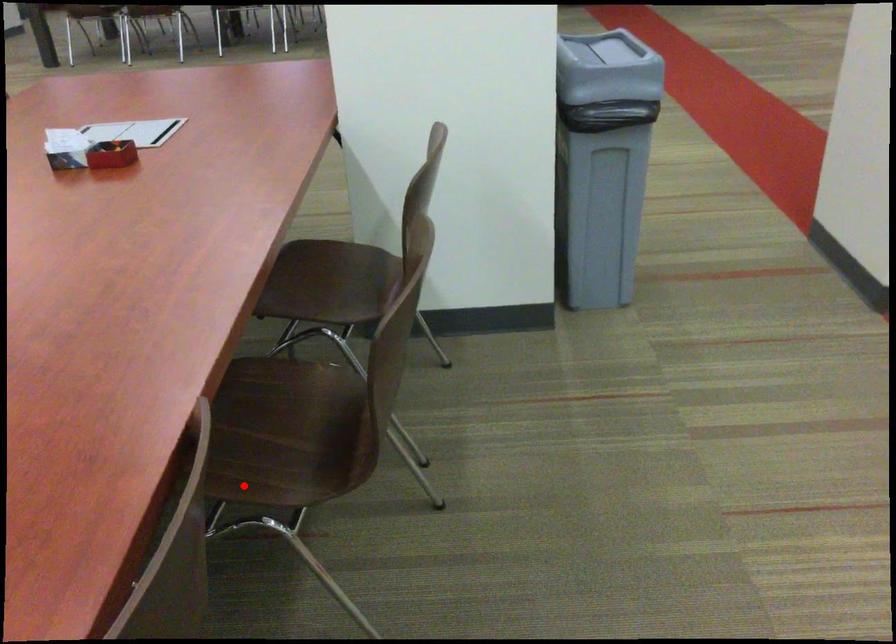
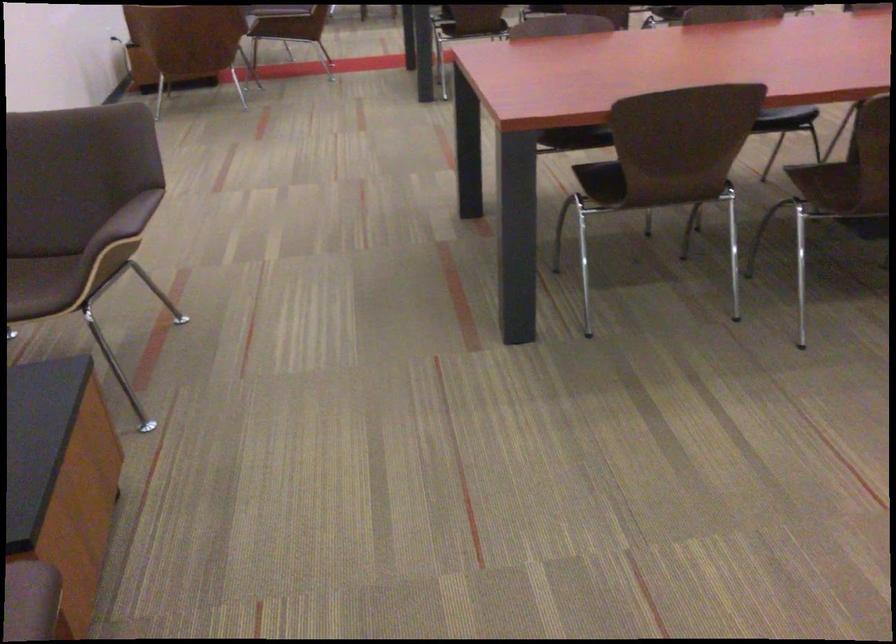
Question: I am providing you with two images of the same scene from different viewpoints. In image1, a red point is highlighted. Considering the same 3D point in image2, which of the following is correct?

Choices:
 (A) It is closer
 (B) It is farther

Answer: (B)